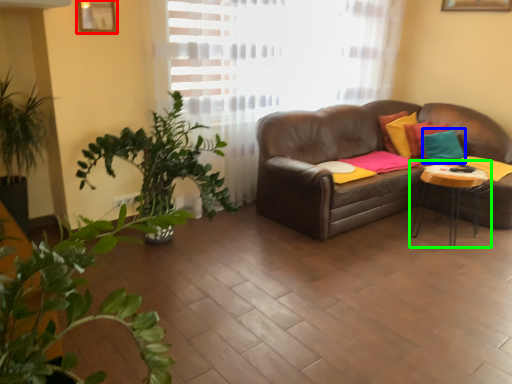
Question: Which object is the closest to the picture frame (highlighted by a red box)? Choose among these: pillow (highlighted by a blue box) or table (highlighted by a green box).

Choices:
 (A) pillow
 (B) table

Answer: (B)